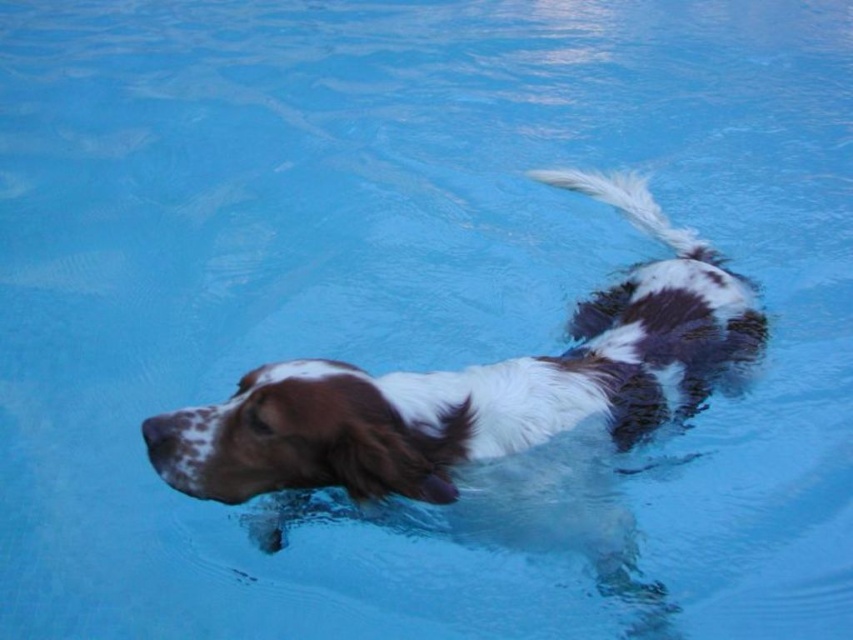
You are a photographer trying to capture the brown and white fur dog at center and the white fluffy tail at upper right in a single shot. Based on their positions, do you think the dog is positioned closer to the camera than the tail?

The brown and white fur dog at center might be wider than white fluffy tail at upper right, so the dog is likely closer to the camera than the tail.

You are a photographer trying to capture the dog in the pool. You want to ensure the brown and white fur dog at center and the white fluffy tail at upper right are both visible in the frame. Based on their positions, can you confirm if the dog is positioned in a way that the tail is above the dog in the image?

The brown and white fur dog at center is below the white fluffy tail at upper right, so yes, the tail is positioned above the dog in the image.

You are a photographer trying to capture the brown and white fur dog at center and the white fluffy tail at upper right in a single shot. Since the dog is moving, you need to know which one is taller to adjust your camera angle. Which object is taller?

The brown and white fur dog at center is taller than the white fluffy tail at upper right.